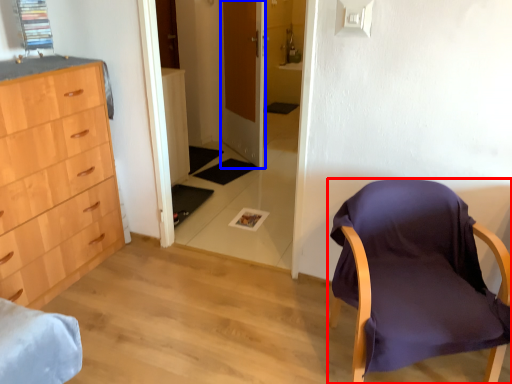
Question: Which point is closer to the camera, chair (highlighted by a red box) or door (highlighted by a blue box)?

Choices:
 (A) chair
 (B) door

Answer: (A)